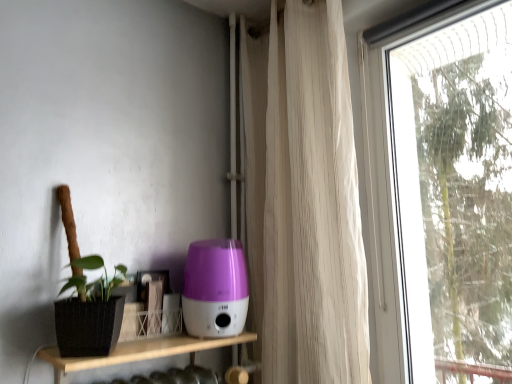
Question: Does transparent glass window at right have a greater width compared to purple plastic humidifier at center?

Choices:
 (A) yes
 (B) no

Answer: (B)

Question: Is transparent glass window at right looking in the opposite direction of purple plastic humidifier at center?

Choices:
 (A) no
 (B) yes

Answer: (A)

Question: From a real-world perspective, does transparent glass window at right stand above purple plastic humidifier at center?

Choices:
 (A) no
 (B) yes

Answer: (B)

Question: Does transparent glass window at right lie in front of purple plastic humidifier at center?

Choices:
 (A) no
 (B) yes

Answer: (B)

Question: From the image's perspective, is transparent glass window at right on top of purple plastic humidifier at center?

Choices:
 (A) no
 (B) yes

Answer: (B)

Question: From the image's perspective, is transparent glass window at right beneath purple plastic humidifier at center?

Choices:
 (A) no
 (B) yes

Answer: (A)

Question: Can you confirm if purple plastic humidifier at center is positioned to the left of white sheer curtain at right?

Choices:
 (A) yes
 (B) no

Answer: (A)

Question: From a real-world perspective, is purple plastic humidifier at center on white sheer curtain at right?

Choices:
 (A) no
 (B) yes

Answer: (A)

Question: Is white sheer curtain at right at the back of purple plastic humidifier at center?

Choices:
 (A) no
 (B) yes

Answer: (A)

Question: Does purple plastic humidifier at center have a lesser height compared to white sheer curtain at right?

Choices:
 (A) yes
 (B) no

Answer: (A)

Question: Considering the relative sizes of purple plastic humidifier at center and white sheer curtain at right in the image provided, is purple plastic humidifier at center thinner than white sheer curtain at right?

Choices:
 (A) yes
 (B) no

Answer: (B)

Question: From the image's perspective, is purple plastic humidifier at center located above white sheer curtain at right?

Choices:
 (A) no
 (B) yes

Answer: (A)

Question: From a real-world perspective, is transparent glass window at right located higher than white sheer curtain at right?

Choices:
 (A) no
 (B) yes

Answer: (A)